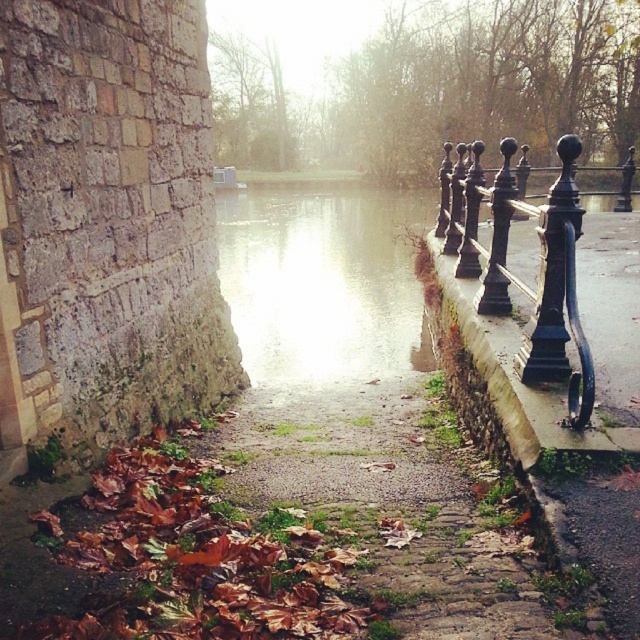
You are standing on the pathway in the scene and want to walk from point (336, 221) to point (486, 314). Which direction should you face to move towards the latter point?

To move from point (336, 221) to point (486, 314), you should face towards the upper right direction since point (486, 314) is located above and to the right of point (336, 221) in the image.

You are standing on the pathway and want to cross to the other side of the glistening water at center. There is a black wrought iron fence at right nearby. Can you use the fence to help you cross the water?

The glistening water at center is taller than the black wrought iron fence at right, which means the fence is shorter. Since the water is taller, it might be deeper or higher than the fence, making it unsafe to use the fence as a crossing aid. Consider finding another path or waiting for the water level to drop.

You are a painter standing on the pathway and want to paint the glistening water at center and the black wrought iron fence at right. Which object should you focus on first if you want to paint the wider one?

The glistening water at center should be focused on first since its width is larger than the black wrought iron fence at right.